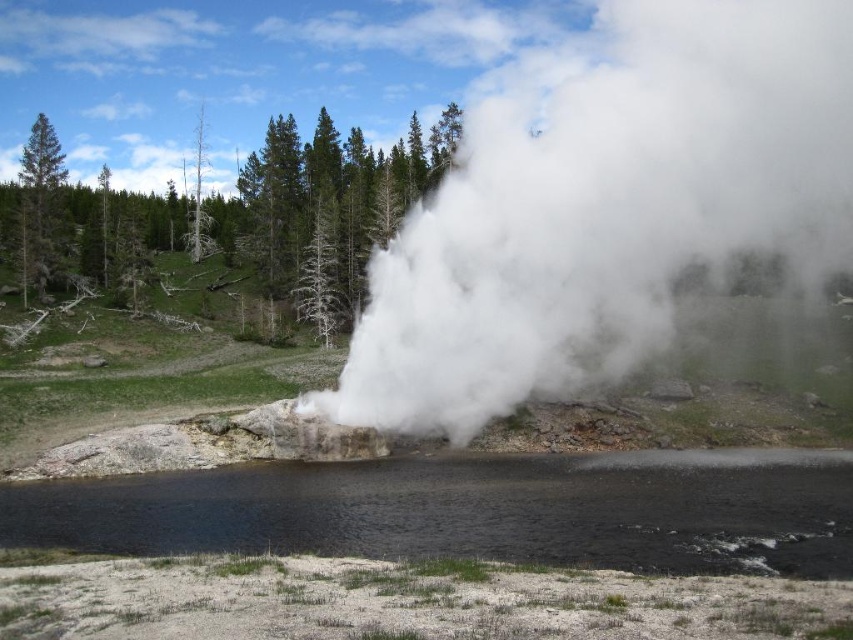
Based on the photo, is green pine tree at upper center above dead wood tree at upper left?

Indeed, green pine tree at upper center is positioned over dead wood tree at upper left.

Does green pine tree at upper center have a smaller size compared to dead wood tree at upper left?

No, green pine tree at upper center is not smaller than dead wood tree at upper left.

I want to click on green pine tree at upper center, so click(225, 220).

Between black smooth water at lower center and green matte tree at left, which one has more height?

With more height is green matte tree at left.

Locate an element on the screen. The height and width of the screenshot is (640, 853). black smooth water at lower center is located at coordinates (473, 509).

This screenshot has width=853, height=640. Describe the element at coordinates (473, 509) in the screenshot. I see `black smooth water at lower center` at that location.

Where is `black smooth water at lower center`? This screenshot has height=640, width=853. black smooth water at lower center is located at coordinates (473, 509).

Between point (480, 394) and point (41, 147), which one is positioned behind?

Positioned behind is point (41, 147).

Is white vapor at center below green matte tree at left?

Actually, white vapor at center is above green matte tree at left.

This screenshot has width=853, height=640. Describe the element at coordinates (606, 209) in the screenshot. I see `white vapor at center` at that location.

The image size is (853, 640). What are the coordinates of `white vapor at center` in the screenshot? It's located at (606, 209).